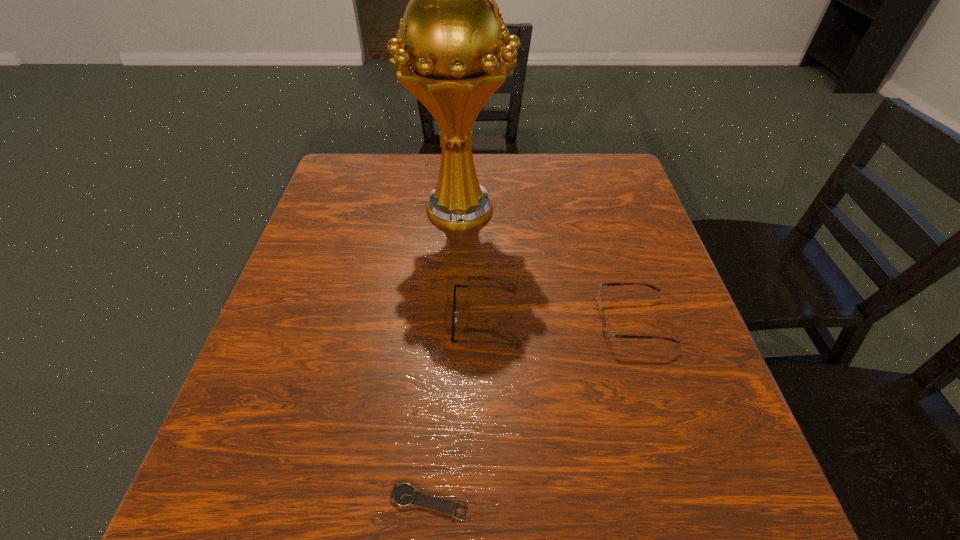
Locate an element on the screen. This screenshot has height=540, width=960. the tallest object is located at coordinates (450, 52).

You are a GUI agent. You are given a task and a screenshot of the screen. Output one action in this format:
    pyautogui.click(x=<x>, y=<y>)
    Task: Click on the farthest object
    
    Given the screenshot: What is the action you would take?
    [x=450, y=52]

You are a GUI agent. You are given a task and a screenshot of the screen. Output one action in this format:
    pyautogui.click(x=<x>, y=<y>)
    Task: Click on the third shortest object
    The width and height of the screenshot is (960, 540).
    Given the screenshot: What is the action you would take?
    pyautogui.click(x=607, y=331)

The width and height of the screenshot is (960, 540). Find the location of `the taller spectacles`. the taller spectacles is located at coordinates click(607, 331).

You are a GUI agent. You are given a task and a screenshot of the screen. Output one action in this format:
    pyautogui.click(x=<x>, y=<y>)
    Task: Click on the left spectacles
    
    Given the screenshot: What is the action you would take?
    pyautogui.click(x=454, y=319)

Locate an element on the screen. the second shortest object is located at coordinates (454, 319).

In order to click on the nearest object in this screenshot , I will do `click(403, 494)`.

You are a GUI agent. You are given a task and a screenshot of the screen. Output one action in this format:
    pyautogui.click(x=<x>, y=<y>)
    Task: Click on the shortest object
    This screenshot has height=540, width=960.
    Given the screenshot: What is the action you would take?
    pyautogui.click(x=403, y=494)

Where is `vacant area located at the front of the tallest object where the globe is prominent`? vacant area located at the front of the tallest object where the globe is prominent is located at coordinates (457, 272).

Find the location of a particular element. The width and height of the screenshot is (960, 540). vacant region located on the front-facing side of the right spectacles is located at coordinates (464, 321).